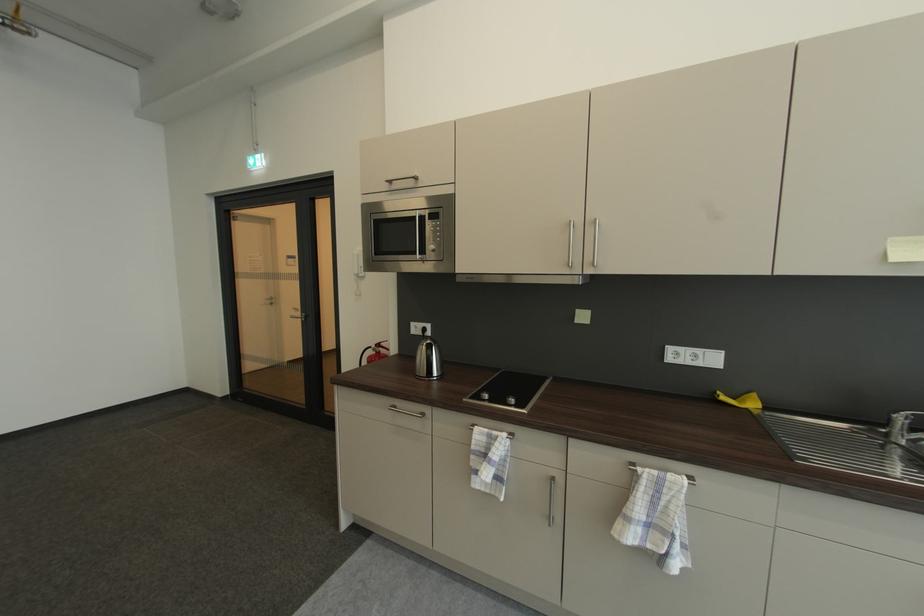
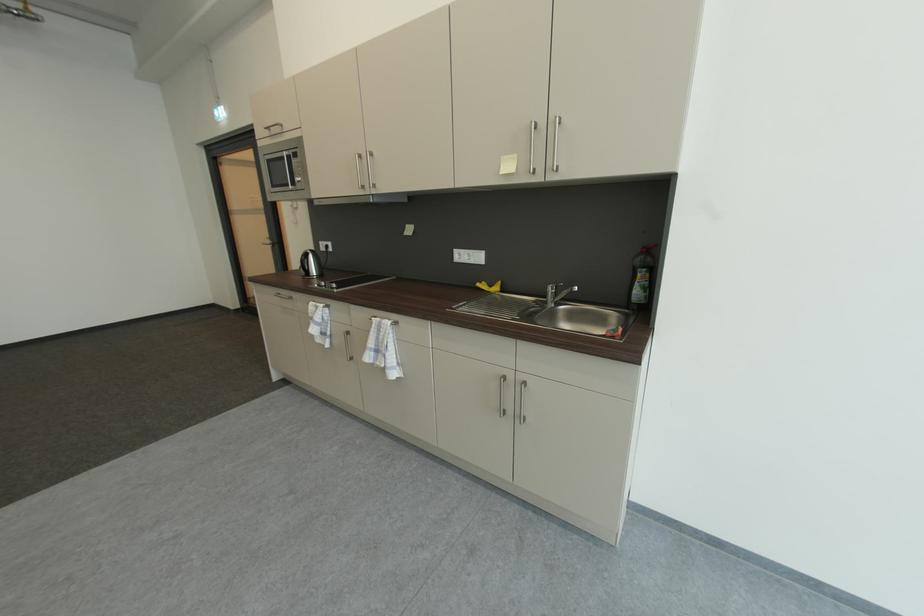
Which direction would the cameraman need to move to produce the second image?

The cameraman walked toward right, backward.